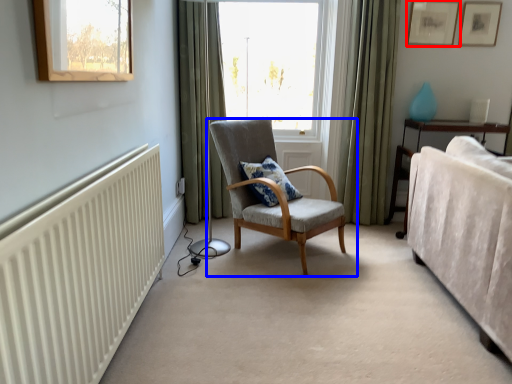
Question: Among these objects, which one is nearest to the camera, picture frame (highlighted by a red box) or chair (highlighted by a blue box)?

Choices:
 (A) picture frame
 (B) chair

Answer: (B)